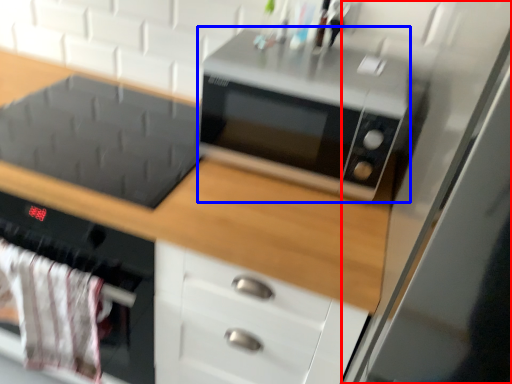
Question: Among these objects, which one is farthest to the camera, glass door (highlighted by a red box) or microwave oven (highlighted by a blue box)?

Choices:
 (A) glass door
 (B) microwave oven

Answer: (B)